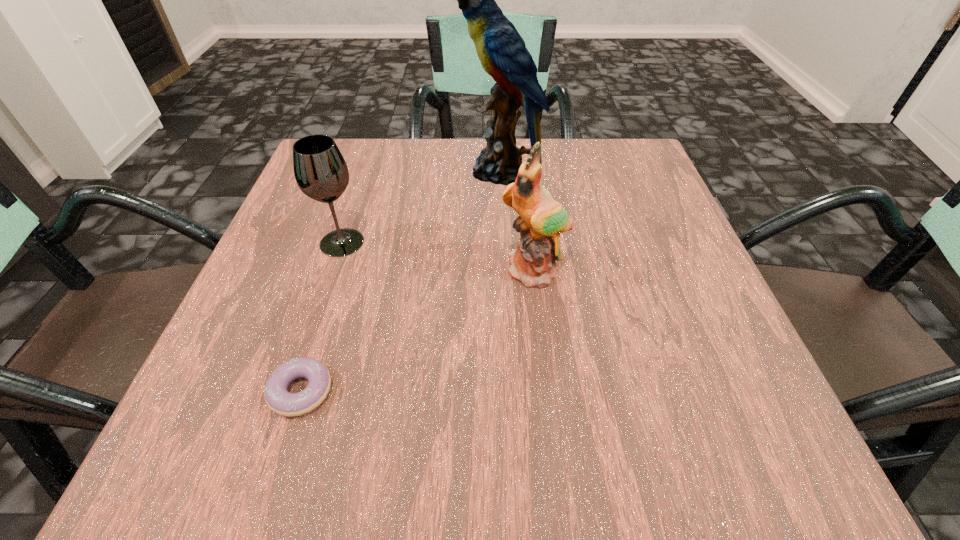
Where is `blank space at the left edge of the desktop`? blank space at the left edge of the desktop is located at coordinates (217, 392).

Identify the location of vacant space at the right edge of the desktop. (665, 206).

Locate an element on the screen. vacant space at the far left corner of the desktop is located at coordinates (341, 143).

This screenshot has height=540, width=960. I want to click on free space at the far right corner of the desktop, so (587, 163).

You are a GUI agent. You are given a task and a screenshot of the screen. Output one action in this format:
    pyautogui.click(x=<x>, y=<y>)
    Task: Click on the free region at the near right corner
    
    Given the screenshot: What is the action you would take?
    pyautogui.click(x=785, y=438)

Identify the location of vacant area between the second shortest object and the farther parrot. The height and width of the screenshot is (540, 960). (421, 207).

Find the location of a particular element. The width and height of the screenshot is (960, 540). free space between the second tallest object and the second shortest object is located at coordinates 438,256.

Where is `free space between the third tallest object and the nearest object`? The image size is (960, 540). free space between the third tallest object and the nearest object is located at coordinates (322, 316).

This screenshot has height=540, width=960. I want to click on vacant area that lies between the wineglass and the taller parrot, so click(x=421, y=207).

Where is `free area in between the nearer parrot and the wineglass`? free area in between the nearer parrot and the wineglass is located at coordinates (438, 256).